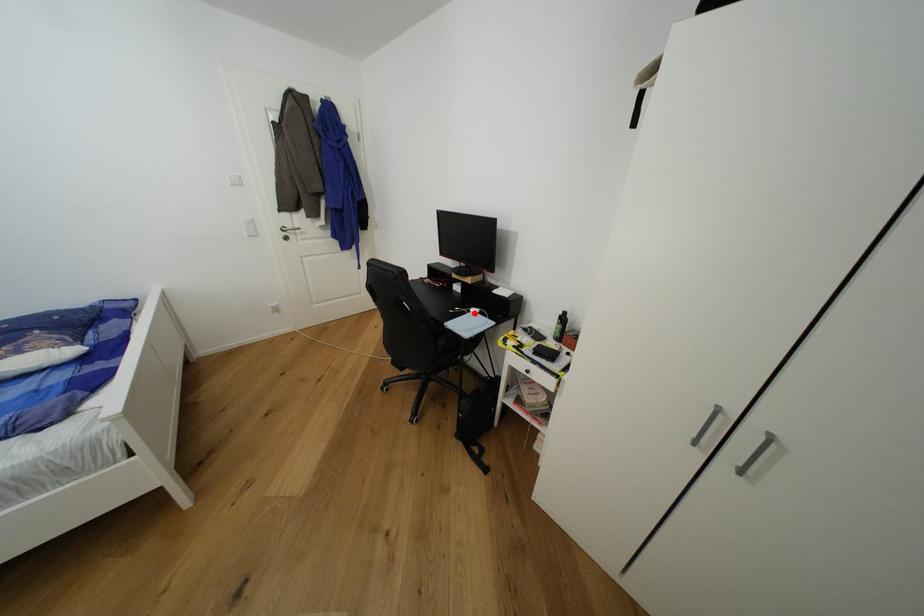
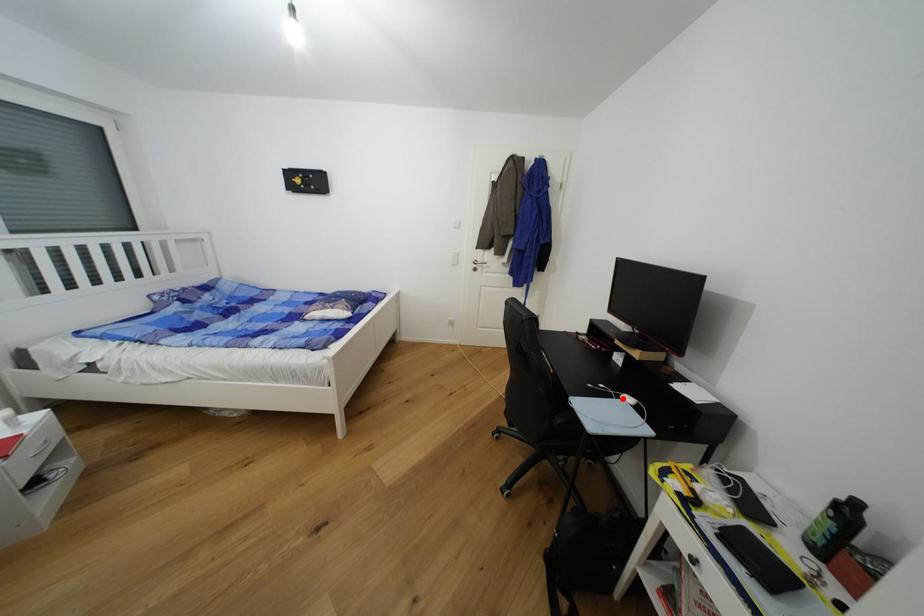
I am providing you with two images of the same scene from different viewpoints. A red point is marked on the first image and another point is marked on the second image. Do the highlighted points in image1 and image2 indicate the same real-world spot?

Yes